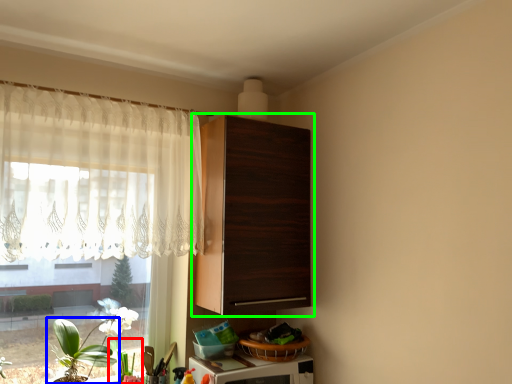
Question: Which is farther away from plant (highlighted by a red box)? houseplant (highlighted by a blue box) or cabinetry (highlighted by a green box)?

Choices:
 (A) houseplant
 (B) cabinetry

Answer: (B)